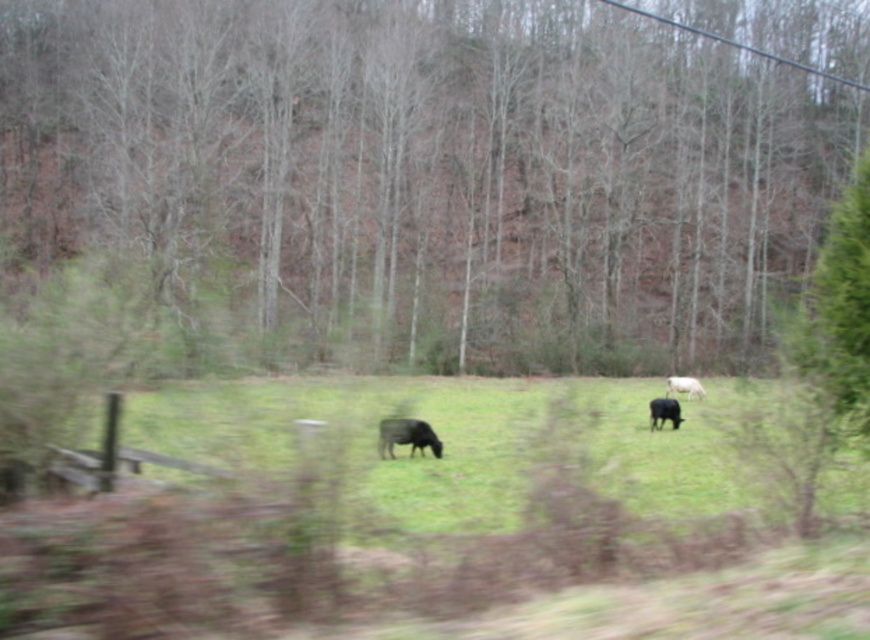
Is black wire at upper right to the left of white woolly sheep at right from the viewer's perspective?

In fact, black wire at upper right is to the right of white woolly sheep at right.

Consider the image. Measure the distance between black wire at upper right and camera.

black wire at upper right and camera are 46.18 meters apart from each other.

This screenshot has height=640, width=870. I want to click on black wire at upper right, so click(x=737, y=44).

In the scene shown: Which of these two, black glossy cow at center or white woolly sheep at right, stands taller?

With more height is white woolly sheep at right.

Who is more forward, (681, 419) or (680, 387)?

Point (681, 419) is more forward.

Which is in front, point (660, 408) or point (696, 384)?

Point (660, 408) is in front.

Where is `black glossy cow at center`? This screenshot has width=870, height=640. black glossy cow at center is located at coordinates (664, 412).

Which is behind, point (730, 44) or point (664, 419)?

Point (730, 44)

Does point (680, 28) lie behind point (679, 417)?

That is True.

Identify the location of black wire at upper right. The height and width of the screenshot is (640, 870). (737, 44).